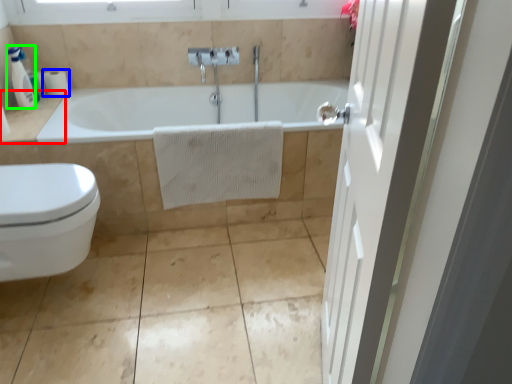
Question: Estimate the real-world distances between objects in this image. Which object is farther from counter top (highlighted by a red box), toilet paper (highlighted by a blue box) or soap dispenser (highlighted by a green box)?

Choices:
 (A) toilet paper
 (B) soap dispenser

Answer: (A)